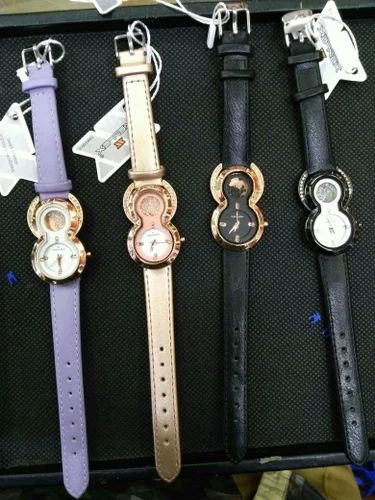
Locate an element on the screen. The image size is (375, 500). display for watches is located at coordinates (189, 150).